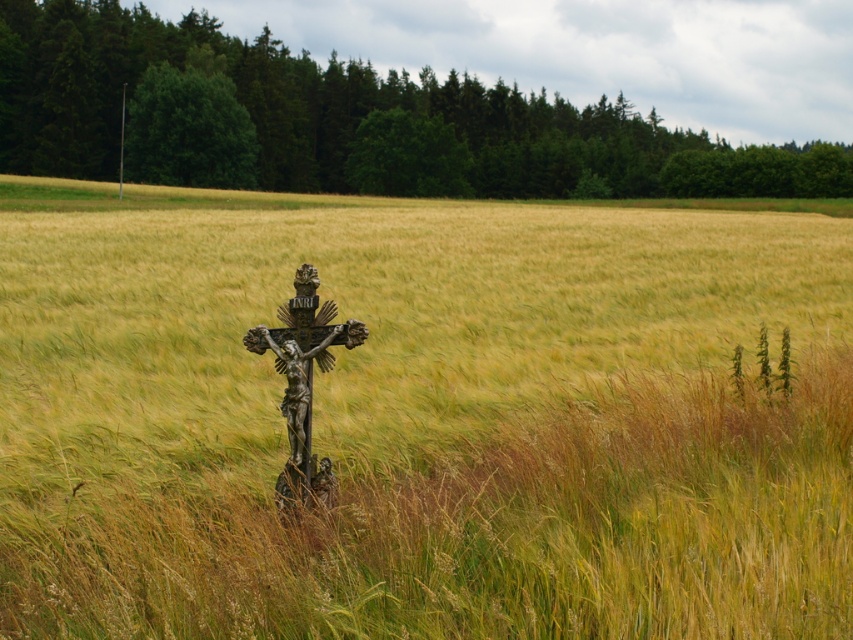
You are a farmer assessing the layout of your rural property. You notice the golden wheat field at center and the bronze crucifix at center. Which object is positioned higher in the scene?

The golden wheat field at center is located above the bronze crucifix at center, so it is positioned higher in the scene.

You are a farmer standing at the edge of your property and see the golden wheat field at center and bronze crucifix at center. Which object is positioned to the right of the other?

The golden wheat field at center is to the right of the bronze crucifix at center.